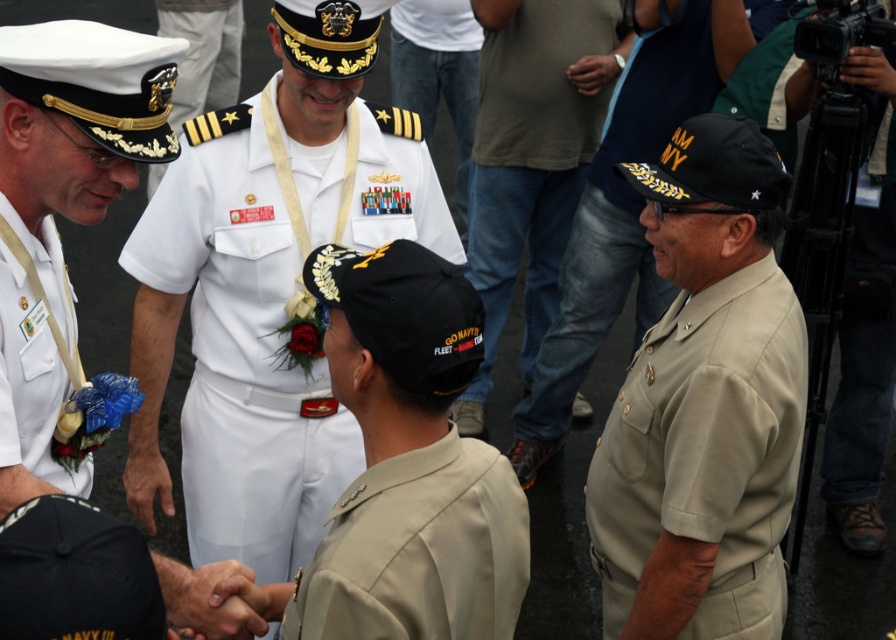
Question: Does white cotton dress uniform at center appear under tan uniform at center?

Choices:
 (A) yes
 (B) no

Answer: (A)

Question: Among these points, which one is farthest from the camera?

Choices:
 (A) (618, 268)
 (B) (58, 353)

Answer: (A)

Question: Which point is farther to the camera?

Choices:
 (A) white cotton dress uniform at center
 (B) tan fabric uniform at center
 (C) tan uniform at center

Answer: (C)

Question: Which object appears farthest from the camera in this image?

Choices:
 (A) black fabric cap at lower right
 (B) khaki fabric uniform at right
 (C) white matte uniform at left
 (D) tan fabric uniform at center

Answer: (A)

Question: Is tan uniform at center below white matte uniform at left?

Choices:
 (A) no
 (B) yes

Answer: (A)

Question: Does white cotton dress uniform at center come in front of tan uniform at center?

Choices:
 (A) no
 (B) yes

Answer: (B)